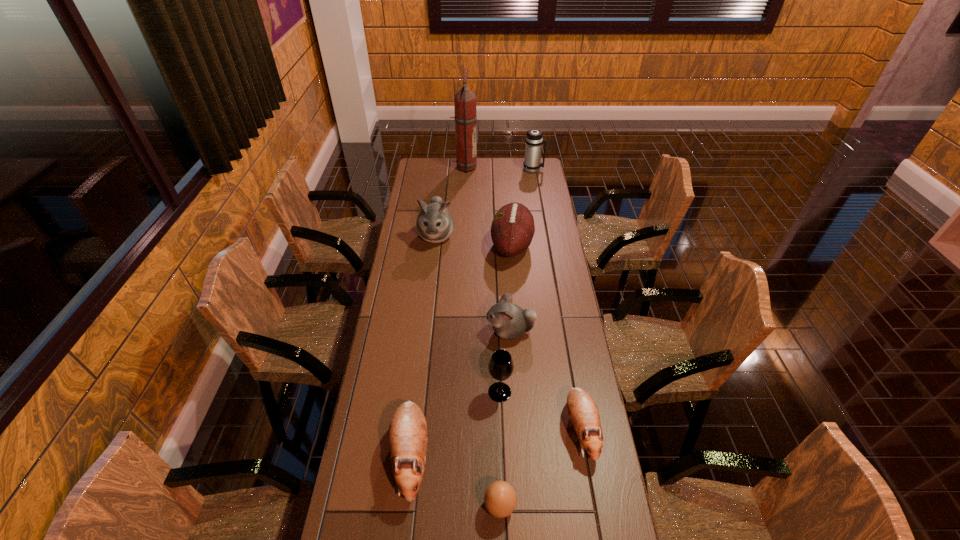
Where is `hamster that is the third closest one to the bigger brown hamster`? The width and height of the screenshot is (960, 540). hamster that is the third closest one to the bigger brown hamster is located at coordinates (435, 224).

You are a GUI agent. You are given a task and a screenshot of the screen. Output one action in this format:
    pyautogui.click(x=<x>, y=<y>)
    Task: Click on the hamster object that ranks as the second closest to the left brown hamster
    The width and height of the screenshot is (960, 540).
    Given the screenshot: What is the action you would take?
    pyautogui.click(x=583, y=412)

Identify which brown hamster is the second nearest to the brown football (American). Please provide its 2D coordinates. Your answer should be formatted as a tuple, i.e. [(x, y)], where the tuple contains the x and y coordinates of a point satisfying the conditions above.

[(407, 435)]

Find the location of a particular element. This screenshot has width=960, height=540. free region that satisfies the following two spatial constraints: 1. on the face of the second hamster from right to left; 2. at the face of the bigger brown hamster is located at coordinates [518, 456].

Identify the location of free space that satisfies the following two spatial constraints: 1. on the side of the fire extinguisher with the label and nozzle; 2. on the back side of the wineglass. The image size is (960, 540). (454, 392).

What are the coordinates of `free location that satisfies the following two spatial constraints: 1. on the face of the left white hamster; 2. on the left side of the brown boiled egg` in the screenshot? It's located at (405, 507).